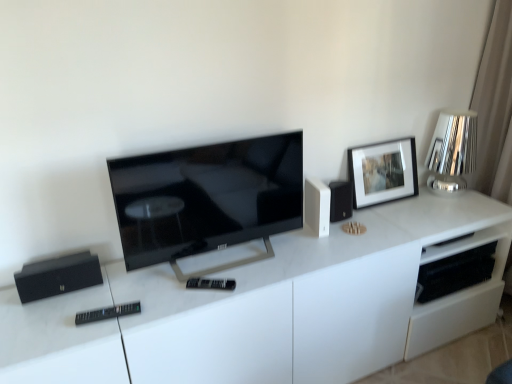
Question: Is black plastic remote at center, the second remote positioned from the front, wider than black plastic remote at lower left, marked as the 2th remote in a back-to-front arrangement?

Choices:
 (A) no
 (B) yes

Answer: (A)

Question: Can you confirm if black plastic remote at center, the 1th remote when ordered from right to left, is positioned to the left of black plastic remote at lower left, marked as the 1th remote in a bottom-to-top arrangement?

Choices:
 (A) yes
 (B) no

Answer: (B)

Question: Does black plastic remote at center, which ranks as the first remote in top-to-bottom order, have a lesser width compared to black plastic remote at lower left, marked as the 2th remote in a back-to-front arrangement?

Choices:
 (A) yes
 (B) no

Answer: (A)

Question: Can you confirm if black plastic remote at center, acting as the 1th remote starting from the back, is taller than black plastic remote at lower left, placed as the 2th remote when sorted from top to bottom?

Choices:
 (A) yes
 (B) no

Answer: (B)

Question: Does black plastic remote at center, placed as the second remote when sorted from left to right, appear on the right side of black plastic remote at lower left, marked as the second remote in a right-to-left arrangement?

Choices:
 (A) no
 (B) yes

Answer: (B)

Question: From the image's perspective, is black plastic remote at center, placed as the second remote when sorted from left to right, positioned above or below matte black tv at center?

Choices:
 (A) above
 (B) below

Answer: (B)

Question: Is black plastic remote at center, which appears as the 2th remote when ordered from the bottom, bigger or smaller than matte black tv at center?

Choices:
 (A) small
 (B) big

Answer: (A)

Question: Would you say black plastic remote at center, acting as the 1th remote starting from the back, is to the left or to the right of matte black tv at center in the picture?

Choices:
 (A) right
 (B) left

Answer: (B)

Question: From their relative heights in the image, would you say black plastic remote at center, which ranks as the first remote in top-to-bottom order, is taller or shorter than matte black tv at center?

Choices:
 (A) short
 (B) tall

Answer: (A)

Question: Looking at their shapes, would you say matte black picture frame at upper right is wider or thinner than black plastic remote at lower left, acting as the first remote starting from the left?

Choices:
 (A) thin
 (B) wide

Answer: (B)

Question: From a real-world perspective, relative to black plastic remote at lower left, acting as the first remote starting from the left, is matte black picture frame at upper right vertically above or below?

Choices:
 (A) below
 (B) above

Answer: (B)

Question: Does point [374, 183] appear closer or farther from the camera than point [76, 317]?

Choices:
 (A) farther
 (B) closer

Answer: (A)

Question: Considering the positions of matte black picture frame at upper right and black plastic remote at lower left, placed as the 2th remote when sorted from top to bottom, in the image, is matte black picture frame at upper right bigger or smaller than black plastic remote at lower left, placed as the 2th remote when sorted from top to bottom,?

Choices:
 (A) big
 (B) small

Answer: (A)

Question: From the image's perspective, is black plastic remote at lower left, the 1th remote in the front-to-back sequence, positioned above or below white glossy cabinet at center?

Choices:
 (A) below
 (B) above

Answer: (B)

Question: From their relative heights in the image, would you say black plastic remote at lower left, the 1th remote in the front-to-back sequence, is taller or shorter than white glossy cabinet at center?

Choices:
 (A) tall
 (B) short

Answer: (B)